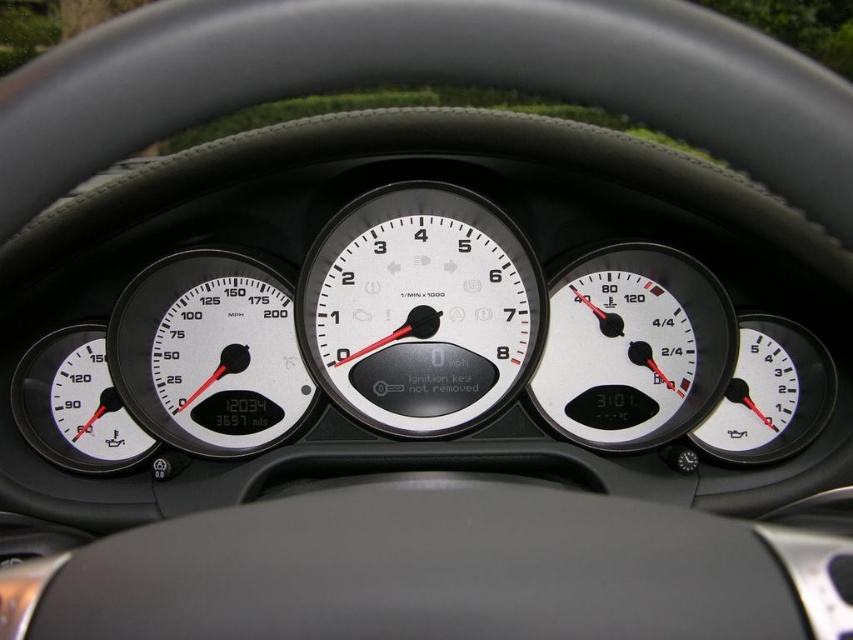
Is point (199, 253) farther from viewer compared to point (83, 458)?

No, it is in front of (83, 458).

Is white glossy speedometer at center left smaller than matte white speedometer at lower left?

Incorrect, white glossy speedometer at center left is not smaller in size than matte white speedometer at lower left.

Find the location of `white glossy speedometer at center left`. white glossy speedometer at center left is located at coordinates (209, 353).

Which of these two, white glossy speedometer at center or white matte gauge at center right, stands shorter?

Standing shorter between the two is white matte gauge at center right.

What do you see at coordinates (419, 308) in the screenshot? The height and width of the screenshot is (640, 853). I see `white glossy speedometer at center` at bounding box center [419, 308].

Identify the location of white glossy speedometer at center. (419, 308).

Does white glossy speedometer at center have a lesser height compared to white glossy speedometer at center left?

Incorrect, white glossy speedometer at center's height does not fall short of white glossy speedometer at center left's.

Who is taller, white glossy speedometer at center or white glossy speedometer at center left?

Standing taller between the two is white glossy speedometer at center.

Who is more distant from viewer, (322, 256) or (173, 435)?

Point (322, 256)

This screenshot has height=640, width=853. Identify the location of white glossy speedometer at center. (419, 308).